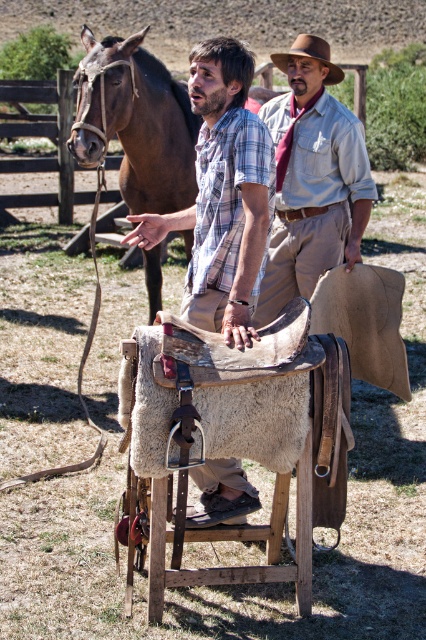
Question: Is brown leather saddle at center positioned in front of brown leather horse at left?

Choices:
 (A) no
 (B) yes

Answer: (B)

Question: Considering the real-world distances, which object is farthest from the plaid shirt at center?

Choices:
 (A) light brown leather shirt at center
 (B) brown leather horse at left
 (C) brown felt cowboy hat at upper center
 (D) brown leather saddle at center

Answer: (B)

Question: Is light brown leather shirt at center above brown leather horse at left?

Choices:
 (A) yes
 (B) no

Answer: (B)

Question: Is light brown leather shirt at center positioned before brown felt cowboy hat at upper center?

Choices:
 (A) no
 (B) yes

Answer: (B)

Question: Which object is positioned farthest from the brown leather horse at left?

Choices:
 (A) brown leather saddle at center
 (B) light brown leather shirt at center
 (C) brown felt cowboy hat at upper center
 (D) plaid shirt at center

Answer: (A)

Question: Which of the following is the farthest from the observer?

Choices:
 (A) (301, 42)
 (B) (195, 516)

Answer: (A)